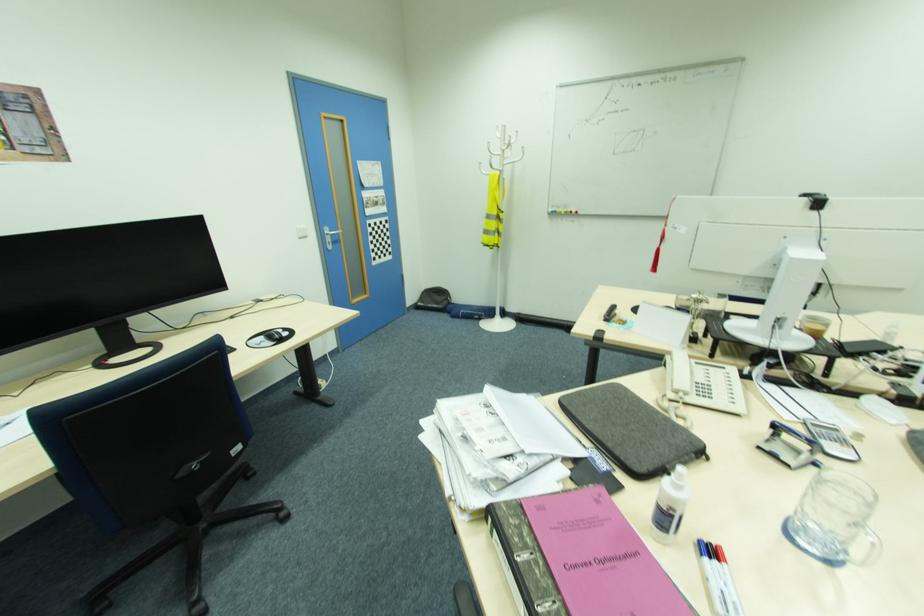
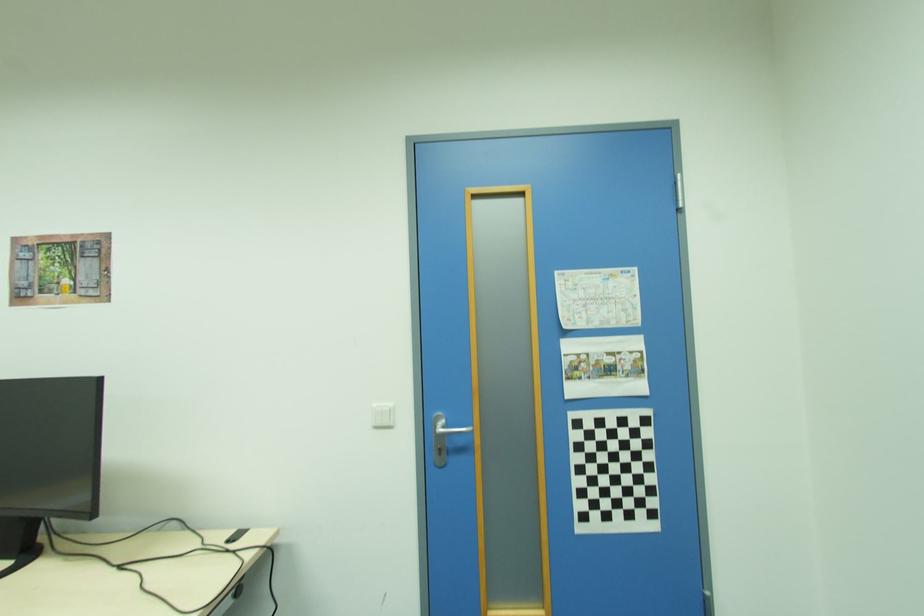
In the second image, find the point that corresponds to (373,185) in the first image.

(599, 325)